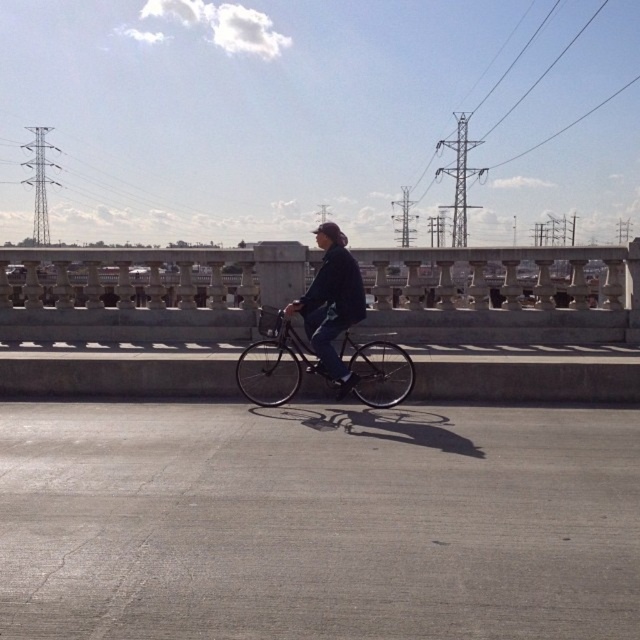
Question: Which of the following is the closest to the observer?

Choices:
 (A) (317, 284)
 (B) (282, 400)

Answer: (A)

Question: Which point appears closest to the camera in this image?

Choices:
 (A) (353, 260)
 (B) (390, 387)

Answer: (A)

Question: Considering the relative positions of shiny black bicycle at center and dark blue denim jacket at center in the image provided, where is shiny black bicycle at center located with respect to dark blue denim jacket at center?

Choices:
 (A) left
 (B) right

Answer: (A)

Question: Is shiny black bicycle at center to the right of dark blue denim jacket at center from the viewer's perspective?

Choices:
 (A) yes
 (B) no

Answer: (B)

Question: Is shiny black bicycle at center further to the viewer compared to dark blue denim jacket at center?

Choices:
 (A) no
 (B) yes

Answer: (B)